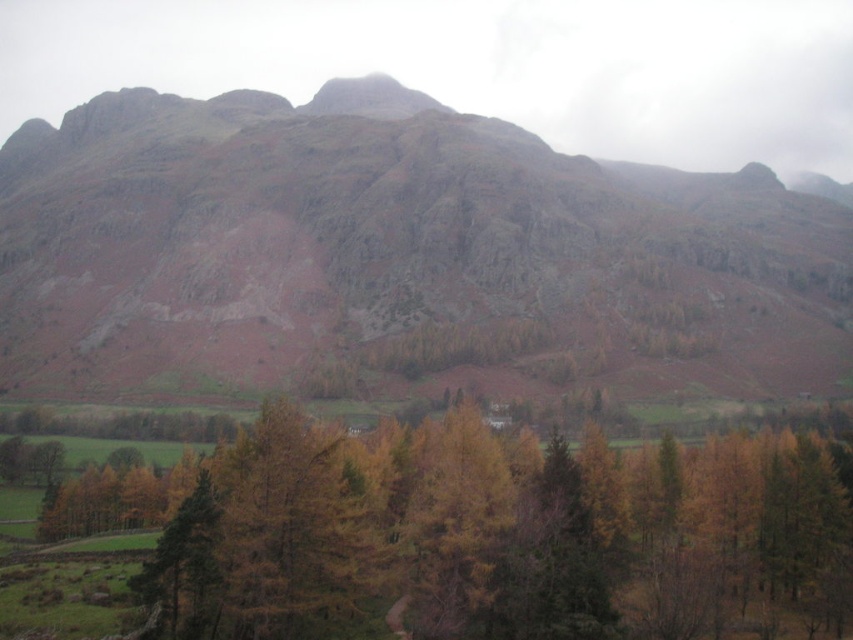
Does rusty rock mountain at center appear over yellow-brown wood at center?

Yes, rusty rock mountain at center is above yellow-brown wood at center.

Does point (62, 352) lie behind point (91, 493)?

Yes, point (62, 352) is farther from viewer.

You are a GUI agent. You are given a task and a screenshot of the screen. Output one action in this format:
    pyautogui.click(x=<x>, y=<y>)
    Task: Click on the rusty rock mountain at center
    Image resolution: width=853 pixels, height=640 pixels.
    Given the screenshot: What is the action you would take?
    pyautogui.click(x=396, y=257)